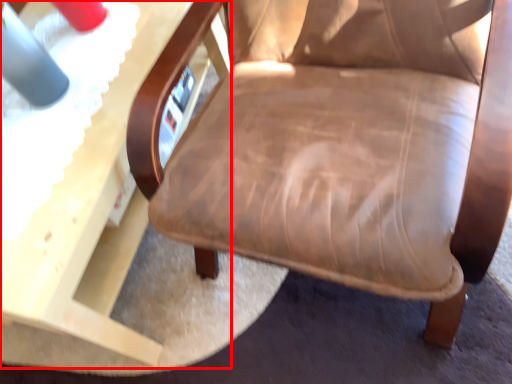
Question: Where is table (annotated by the red box) located in relation to chair in the image?

Choices:
 (A) right
 (B) left

Answer: (B)